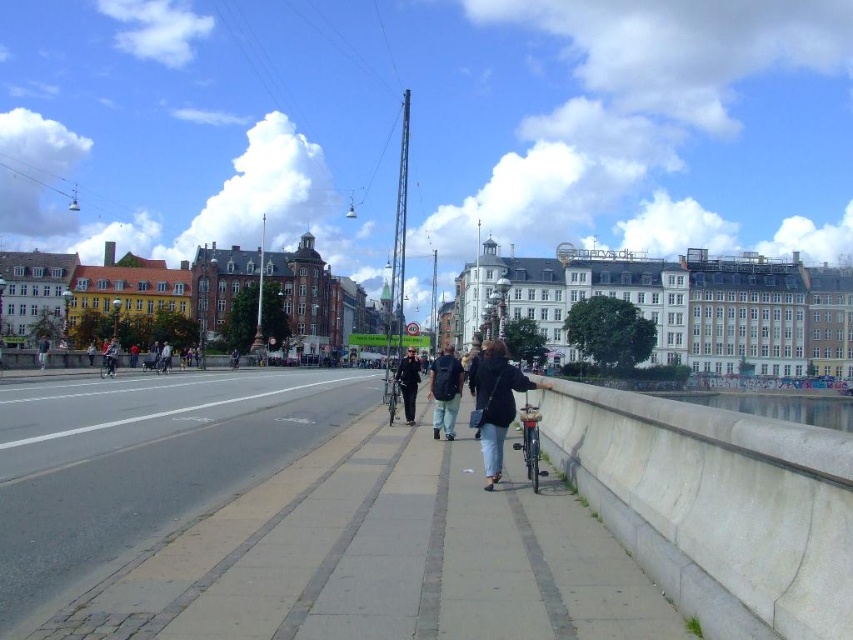
You are a pedestrian standing on the light colored stone tiles pathway in the foreground. You see a dark blue backpack at center and a dark blue uniform at center. Which object is closer to you?

The dark blue backpack at center is located below the dark blue uniform at center, so the dark blue uniform at center is closer to you.

You are a delivery person standing on the pedestrian pathway and need to carry both the dark blue backpack at center and the dark blue uniform at center. Which item should you hold in your hand to free up your back for the other?

The dark blue backpack at center might be wider than dark blue uniform at center, so you should hold the backpack in your hand to free up your back for the uniform.